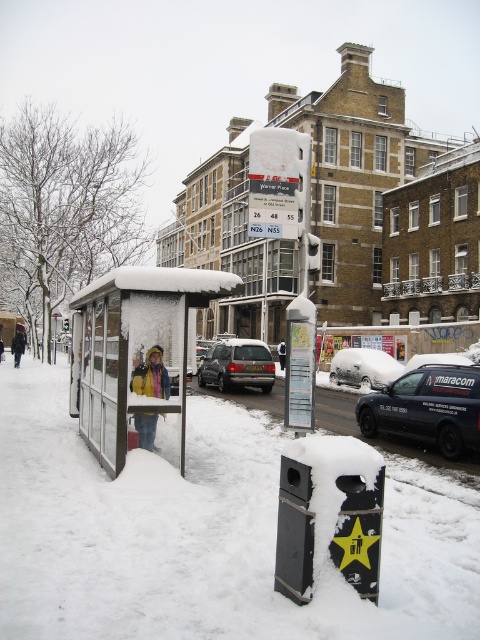
Between black plastic trash can at lower center and yellow jacket at center, which one appears on the left side from the viewer's perspective?

yellow jacket at center is more to the left.

Based on the photo, between black plastic trash can at lower center and yellow jacket at center, which one has more height?

With more height is black plastic trash can at lower center.

Which is in front, point (300, 442) or point (144, 362)?

Point (300, 442)

This screenshot has width=480, height=640. I want to click on black plastic trash can at lower center, so click(336, 513).

Who is positioned more to the right, white fluffy snow at lower center or yellow fabric jacket at left?

white fluffy snow at lower center

Locate an element on the screen. The width and height of the screenshot is (480, 640). white fluffy snow at lower center is located at coordinates (203, 532).

At what (x,y) coordinates should I click in order to perform the action: click on white fluffy snow at lower center. Please return your answer as a coordinate pair (x, y). The width and height of the screenshot is (480, 640). Looking at the image, I should click on (203, 532).

Does white fluffy snow at lower center have a smaller size compared to snow-covered car at center?

Result: No.

Is point (467, 632) farther from camera compared to point (374, 358)?

No.

At what (x,y) coordinates should I click in order to perform the action: click on white fluffy snow at lower center. Please return your answer as a coordinate pair (x, y). Looking at the image, I should click on (203, 532).

The height and width of the screenshot is (640, 480). In order to click on white fluffy snow at lower center in this screenshot , I will do `click(203, 532)`.